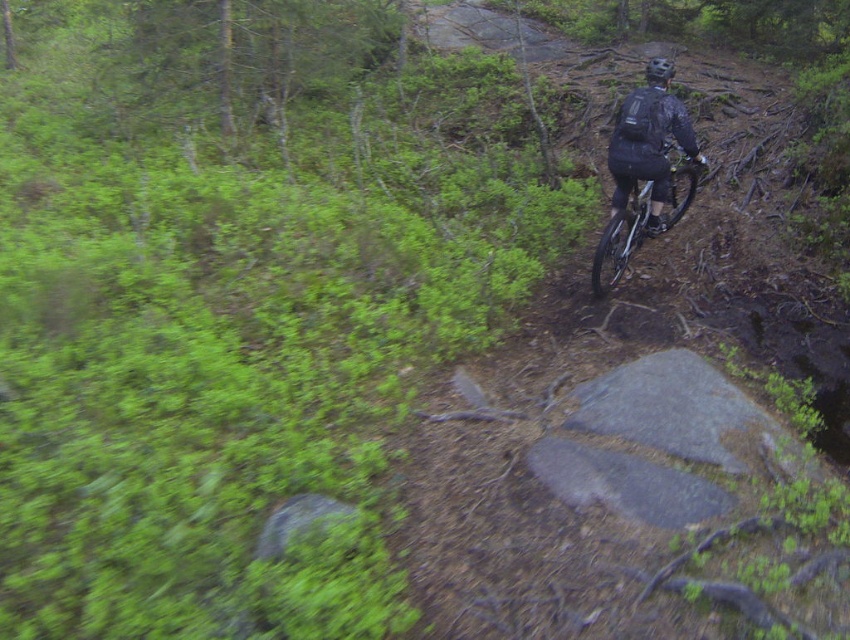
Question: Which object appears farthest from the camera in this image?

Choices:
 (A) black matte jacket at upper right
 (B) matte black helmet at upper center
 (C) silver metallic bicycle at center

Answer: (B)

Question: Can you confirm if black matte jacket at upper right is wider than silver metallic bicycle at center?

Choices:
 (A) yes
 (B) no

Answer: (B)

Question: Considering the real-world distances, which object is closest to the matte black helmet at upper center?

Choices:
 (A) black matte jacket at upper right
 (B) silver metallic bicycle at center

Answer: (A)

Question: Observing the image, what is the correct spatial positioning of black matte jacket at upper right in reference to matte black helmet at upper center?

Choices:
 (A) left
 (B) right

Answer: (A)

Question: Which point is closer to the camera?

Choices:
 (A) 680,108
 (B) 658,77
 (C) 592,275

Answer: (A)

Question: Is silver metallic bicycle at center wider than matte black helmet at upper center?

Choices:
 (A) no
 (B) yes

Answer: (B)